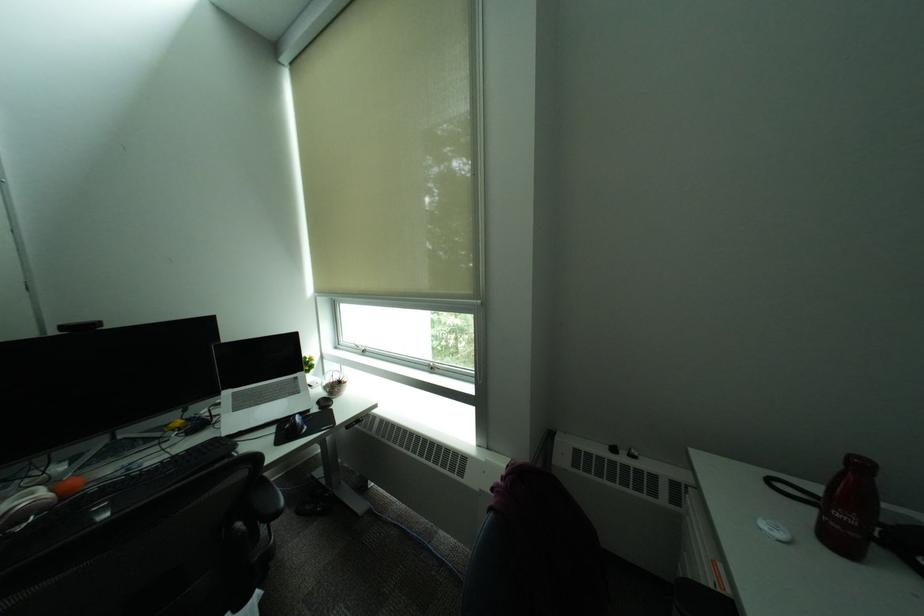
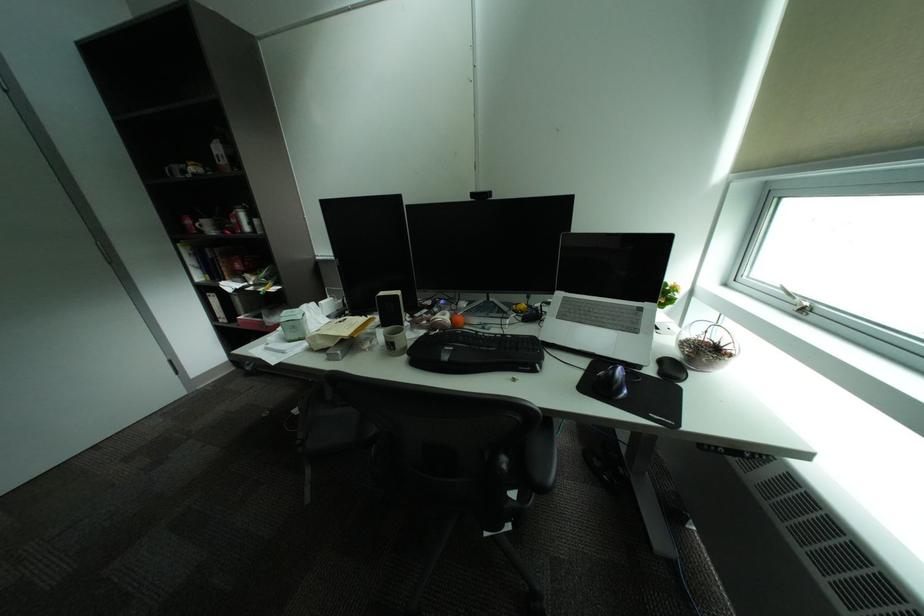
Where in the second image is the point corresponding to (334,386) from the first image?

(694, 339)